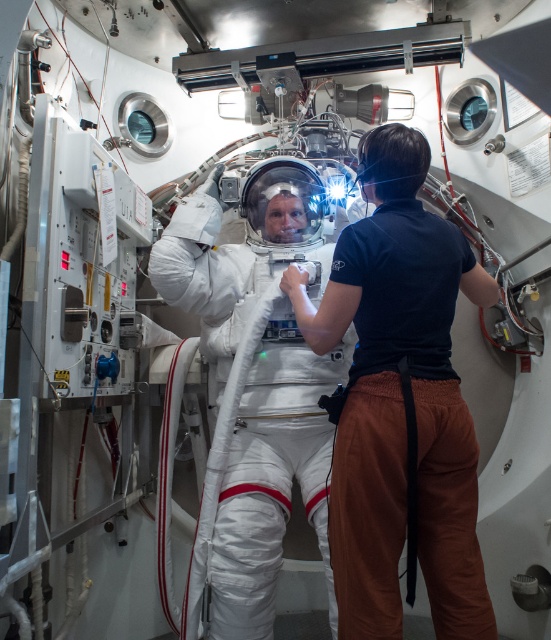
Consider the image. You are an engineer inspecting the space simulation chamber. You notice two spacesuits at the center of the chamber. Which spacesuit is on top, the white fabric spacesuit at center or the white smooth spacesuit at center?

The white fabric spacesuit at center is positioned over the white smooth spacesuit at center, so the white fabric spacesuit at center is on top.